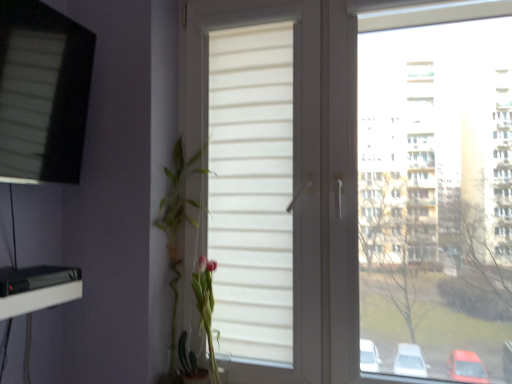
Question: Is white matte window at center, the first window when ordered from right to left, inside green leafy plant at left?

Choices:
 (A) yes
 (B) no

Answer: (B)

Question: Is green leafy plant at left located outside white matte window at center, the first window when ordered from right to left?

Choices:
 (A) yes
 (B) no

Answer: (B)

Question: Could you tell me if green leafy plant at left is facing white matte window at center, which is the 2th window in left-to-right order?

Choices:
 (A) yes
 (B) no

Answer: (B)

Question: From a real-world perspective, is green leafy plant at left positioned under white matte window at center, the first window when ordered from right to left, based on gravity?

Choices:
 (A) yes
 (B) no

Answer: (A)

Question: Does green leafy plant at left have a greater width compared to white matte window at center, which is the 2th window in left-to-right order?

Choices:
 (A) no
 (B) yes

Answer: (B)

Question: In terms of height, does white matte window at center, the first window when ordered from right to left, look taller or shorter compared to matte black screen at upper left, which appears as the 2th window when viewed from the right?

Choices:
 (A) short
 (B) tall

Answer: (B)

Question: Is point (340, 294) positioned closer to the camera than point (50, 94)?

Choices:
 (A) closer
 (B) farther

Answer: (B)

Question: From a real-world perspective, is white matte window at center, which is the 2th window in left-to-right order, physically located above or below matte black screen at upper left, which appears as the 2th window when viewed from the right?

Choices:
 (A) below
 (B) above

Answer: (A)

Question: Considering the positions of white matte window at center, the first window when ordered from right to left, and matte black screen at upper left, which appears as the 2th window when viewed from the right, in the image, is white matte window at center, the first window when ordered from right to left, wider or thinner than matte black screen at upper left, which appears as the 2th window when viewed from the right,?

Choices:
 (A) thin
 (B) wide

Answer: (B)

Question: From the image's perspective, is matte black screen at upper left, the first window from the left, above or below green leafy plant at left?

Choices:
 (A) below
 (B) above

Answer: (B)

Question: In the image, is matte black screen at upper left, the first window from the left, positioned in front of or behind green leafy plant at left?

Choices:
 (A) front
 (B) behind

Answer: (A)

Question: Choose the correct answer: Is matte black screen at upper left, the first window from the left, inside green leafy plant at left or outside it?

Choices:
 (A) outside
 (B) inside

Answer: (A)

Question: From a real-world perspective, is matte black screen at upper left, which appears as the 2th window when viewed from the right, above or below green leafy plant at left?

Choices:
 (A) above
 (B) below

Answer: (A)

Question: In the image, is green leafy plant at left on the left side or the right side of white matte window at center, the first window when ordered from right to left?

Choices:
 (A) right
 (B) left

Answer: (B)

Question: From the image's perspective, is green leafy plant at left above or below white matte window at center, which is the 2th window in left-to-right order?

Choices:
 (A) above
 (B) below

Answer: (B)